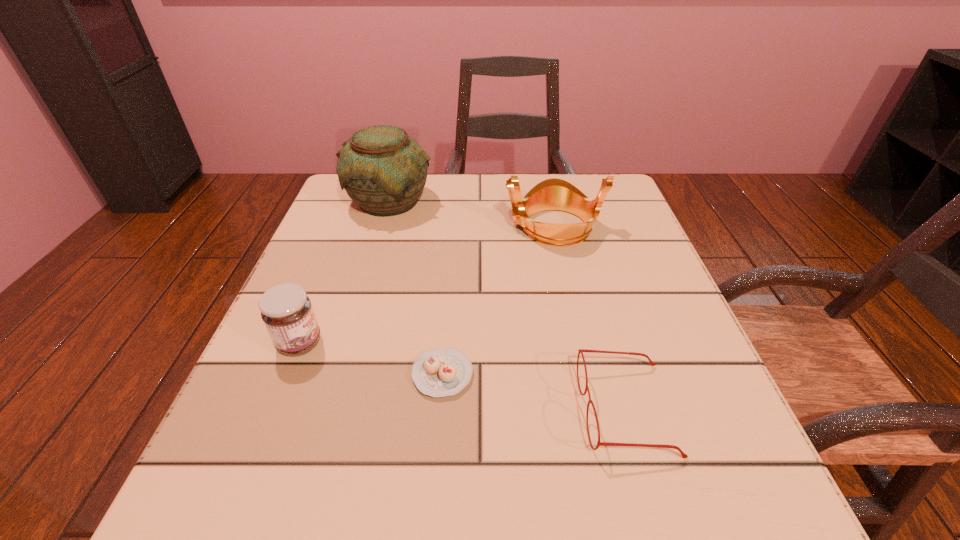
This screenshot has width=960, height=540. In order to click on pottery in this screenshot , I will do `click(383, 170)`.

Locate an element on the screen. The width and height of the screenshot is (960, 540). the fourth shortest object is located at coordinates (552, 194).

Where is `jam`? The height and width of the screenshot is (540, 960). jam is located at coordinates (286, 310).

This screenshot has width=960, height=540. Identify the location of the second shortest object. (581, 351).

The height and width of the screenshot is (540, 960). I want to click on the shortest object, so click(x=439, y=372).

Locate an element on the screen. the third object from left to right is located at coordinates click(x=439, y=372).

The height and width of the screenshot is (540, 960). I want to click on vacant region located 0.210m on the right of the pottery, so click(x=520, y=201).

Locate an element on the screen. free space located at the front emblem of the fourth shortest object is located at coordinates (437, 226).

I want to click on free region located 0.140m at the front emblem of the fourth shortest object, so click(442, 226).

Identify the location of free space located 0.260m at the front emblem of the fourth shortest object. The width and height of the screenshot is (960, 540). (388, 226).